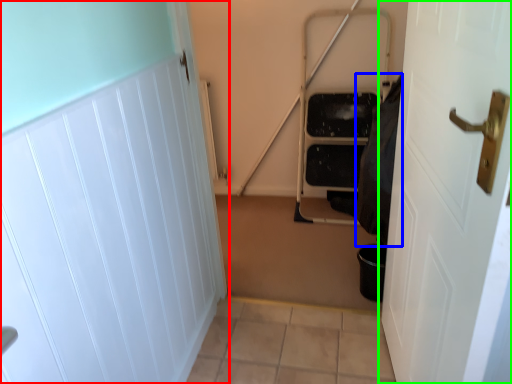
Question: Based on their relative distances, which object is farther from door (highlighted by a red box)? Choose from material (highlighted by a blue box) and door (highlighted by a green box).

Choices:
 (A) material
 (B) door

Answer: (A)